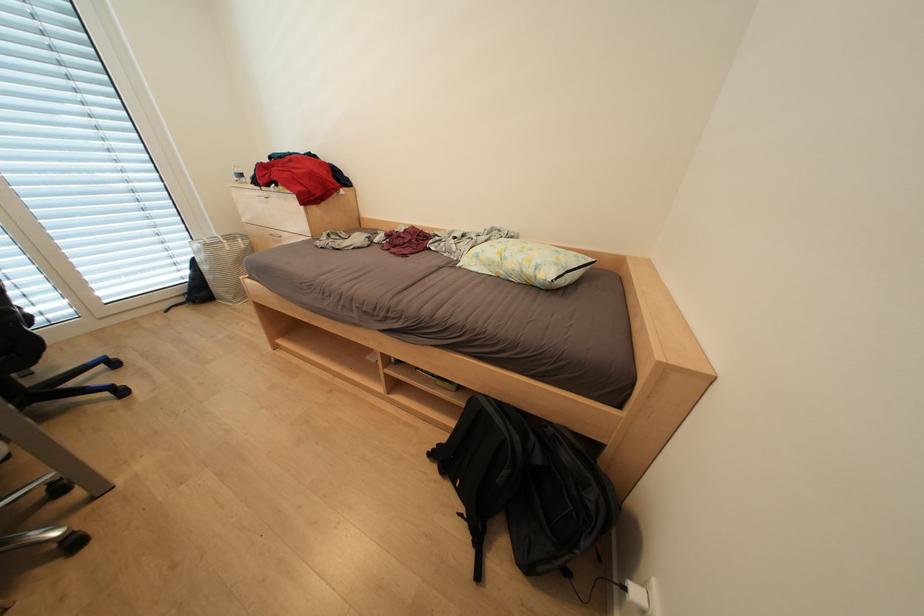
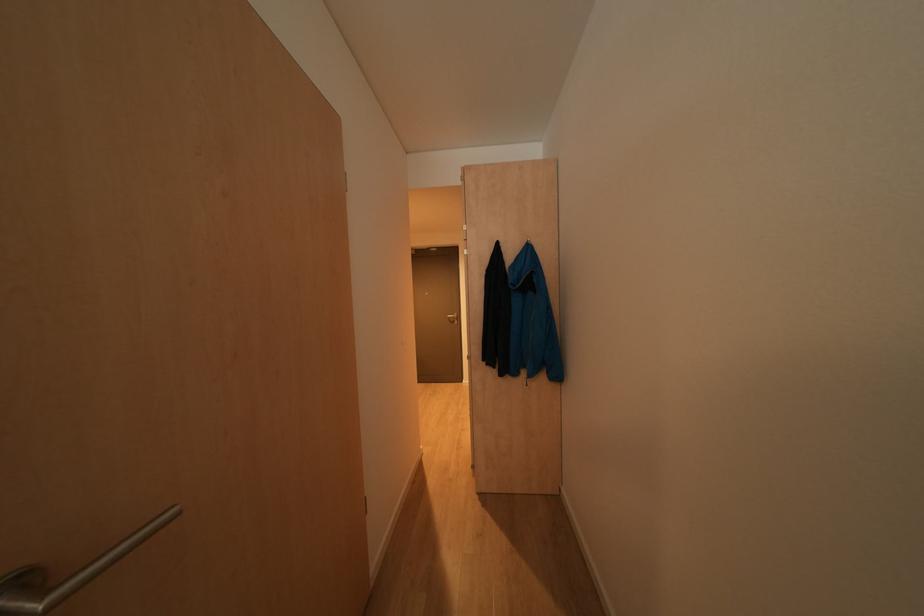
Question: The images are taken continuously from a first-person perspective. In which direction is your viewpoint rotating?

Choices:
 (A) Left
 (B) Right
 (C) Up
 (D) Down

Answer: (B)